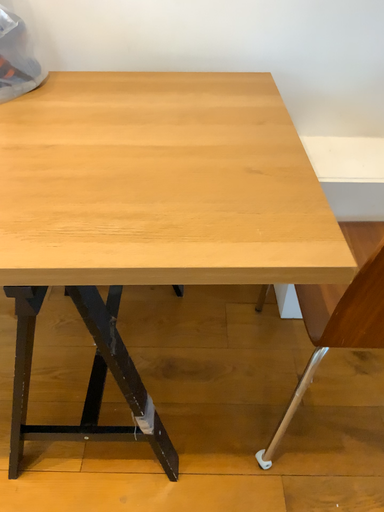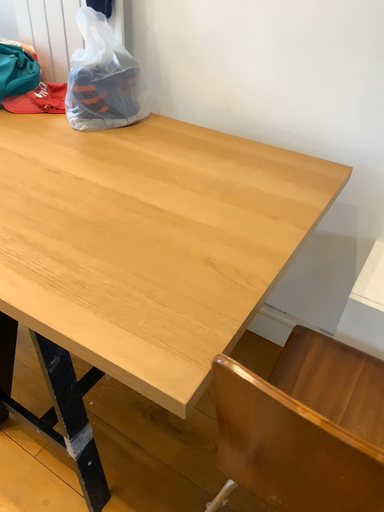
Question: Which way did the camera rotate in the video?

Choices:
 (A) rotated right
 (B) rotated left

Answer: (B)